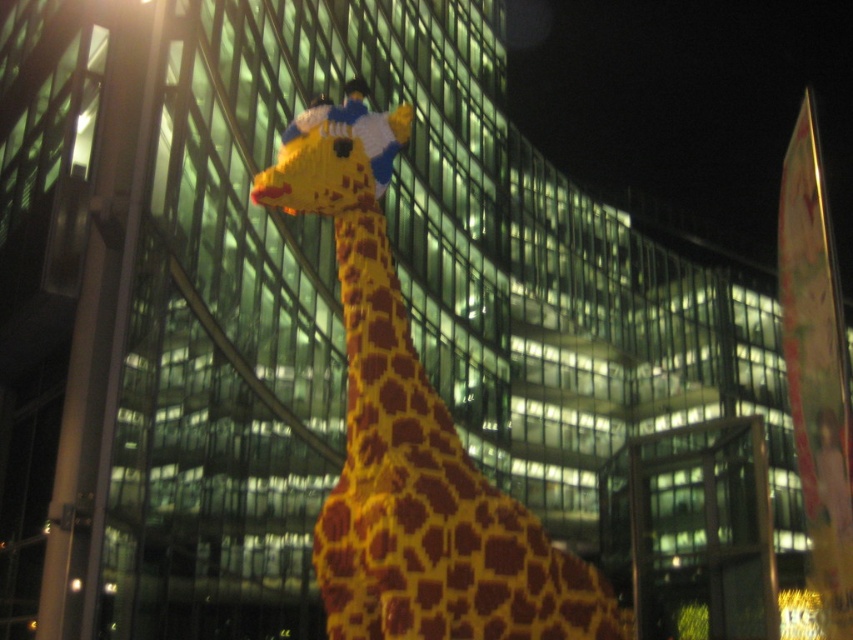
Question: Is yellow matte giraffe at center bigger than metallic pole at left?

Choices:
 (A) no
 (B) yes

Answer: (B)

Question: Is the position of yellow matte giraffe at center less distant than that of metallic pole at left?

Choices:
 (A) yes
 (B) no

Answer: (A)

Question: Does yellow matte giraffe at center have a lesser width compared to metallic pole at left?

Choices:
 (A) no
 (B) yes

Answer: (A)

Question: Among these points, which one is nearest to the camera?

Choices:
 (A) (410, 600)
 (B) (97, 221)

Answer: (A)